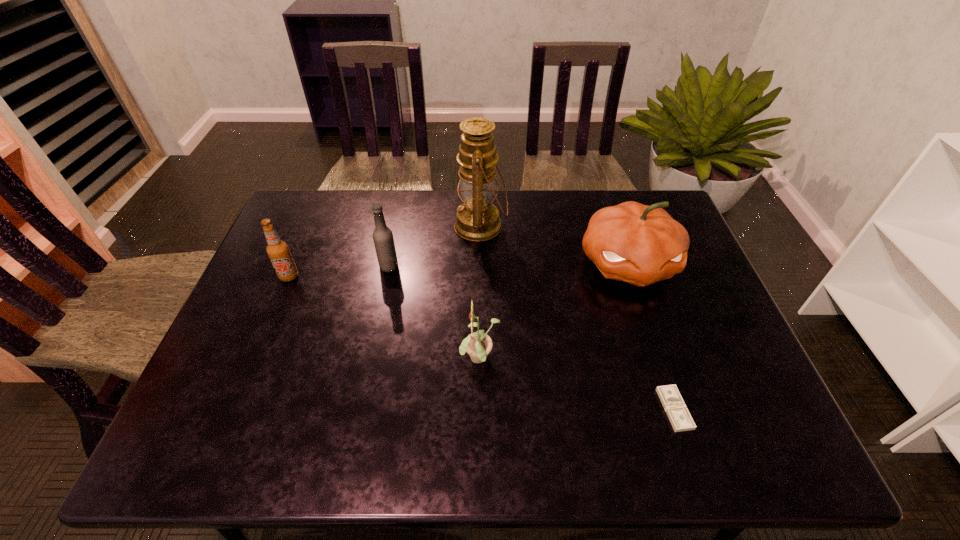
Where is `object that is at the far right corner`? The height and width of the screenshot is (540, 960). object that is at the far right corner is located at coordinates (638, 244).

This screenshot has height=540, width=960. What are the coordinates of `free space at the far edge of the desktop` in the screenshot? It's located at (370, 227).

I want to click on vacant area at the near edge, so click(295, 457).

At what (x,y) coordinates should I click in order to perform the action: click on free region at the left edge of the desktop. Please return your answer as a coordinate pair (x, y). The width and height of the screenshot is (960, 540). Looking at the image, I should click on (269, 316).

At what (x,y) coordinates should I click in order to perform the action: click on free space at the right edge. Please return your answer as a coordinate pair (x, y). The width and height of the screenshot is (960, 540). Looking at the image, I should click on (729, 372).

Locate an element on the screen. Image resolution: width=960 pixels, height=540 pixels. free space at the near left corner of the desktop is located at coordinates (220, 430).

Identify the location of empty location between the sunflower and the nearest object. (577, 384).

You are a GUI agent. You are given a task and a screenshot of the screen. Output one action in this format:
    pyautogui.click(x=<x>, y=<y>)
    Task: Click on the vacant area that lies between the second nearest object and the left beer bottle
    
    Given the screenshot: What is the action you would take?
    pyautogui.click(x=385, y=318)

Identify the location of vacant space in between the money and the sunflower. This screenshot has height=540, width=960. (577, 384).

I want to click on empty space that is in between the leftmost object and the pumpkin, so click(459, 270).